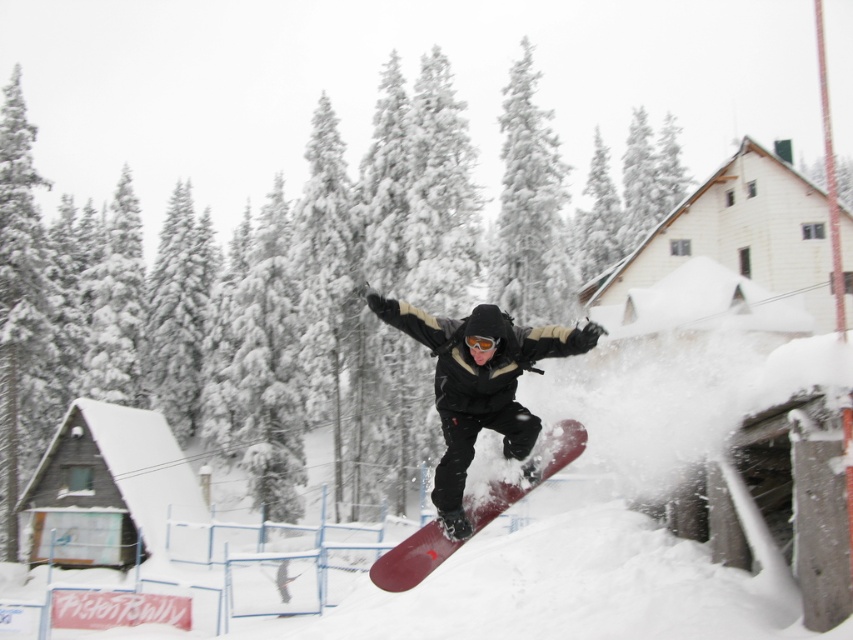
Question: Among these points, which one is nearest to the camera?

Choices:
 (A) (511, 500)
 (B) (463, 467)

Answer: (B)

Question: Where is matte black snowboard at center located in relation to matte red snowboard at center in the image?

Choices:
 (A) below
 (B) above

Answer: (B)

Question: Can you confirm if matte black snowboard at center is positioned above matte red snowboard at center?

Choices:
 (A) no
 (B) yes

Answer: (B)

Question: Is matte black snowboard at center smaller than matte red snowboard at center?

Choices:
 (A) no
 (B) yes

Answer: (A)

Question: Among these points, which one is nearest to the camera?

Choices:
 (A) click(x=456, y=426)
 (B) click(x=540, y=448)

Answer: (A)